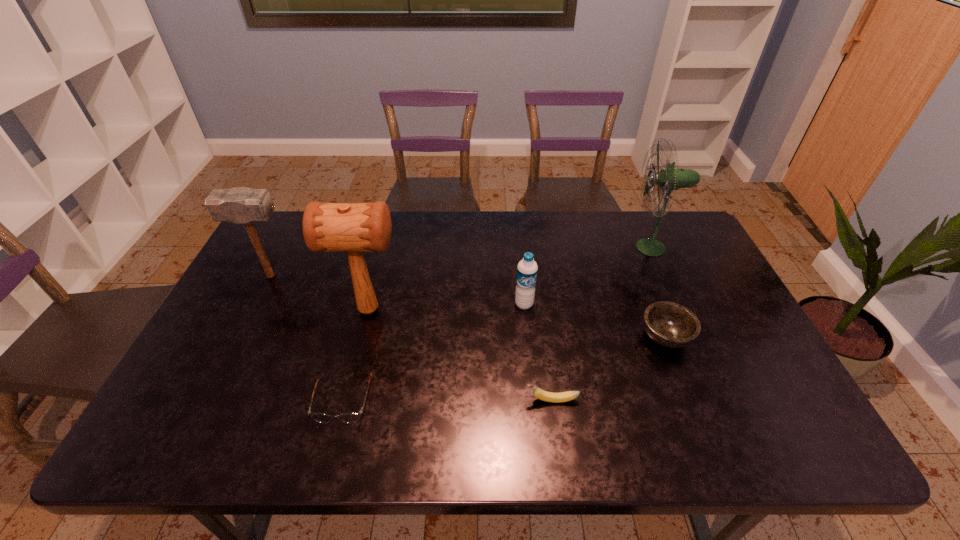
Image resolution: width=960 pixels, height=540 pixels. I want to click on object positioned at the near edge, so click(x=352, y=417).

The image size is (960, 540). Find the location of `object present at the left edge`. object present at the left edge is located at coordinates (240, 205).

The width and height of the screenshot is (960, 540). Identify the location of object that is at the right edge. (668, 179).

Identify the location of object that is at the far right corner. pyautogui.click(x=668, y=179).

The width and height of the screenshot is (960, 540). In order to click on blank space at the far edge in this screenshot , I will do `click(525, 215)`.

At what (x,y) coordinates should I click in order to perform the action: click on free space at the near edge of the desktop. Please return your answer as a coordinate pair (x, y). The width and height of the screenshot is (960, 540). Looking at the image, I should click on (272, 429).

Locate an element on the screen. The image size is (960, 540). vacant space at the left edge of the desktop is located at coordinates (293, 260).

Locate an element on the screen. free location at the right edge of the desktop is located at coordinates (677, 264).

Identify the location of vacant space at the far left corner. (276, 251).

I want to click on vacant area between the nearer mallet and the water bottle, so click(x=446, y=307).